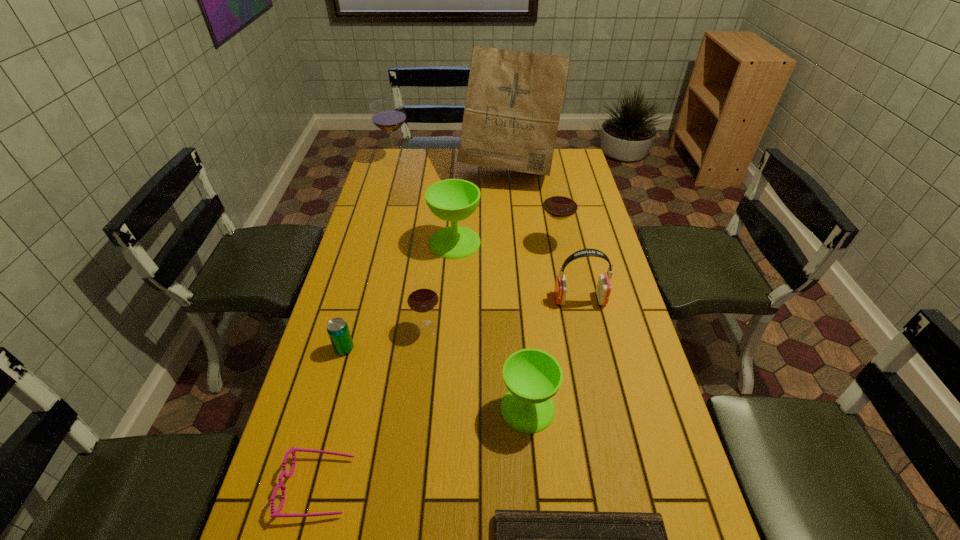
At what (x,y) coordinates should I click in order to perform the action: click on vacant space located 0.060m on the back of the farther green wineglass. Please return your answer as a coordinate pair (x, y). The image size is (960, 540). Looking at the image, I should click on (457, 217).

At what (x,y) coordinates should I click in order to perform the action: click on free space located on the left of the rightmost red wineglass. Please return your answer as a coordinate pair (x, y). This screenshot has width=960, height=540. Looking at the image, I should click on (434, 244).

Identify the location of vacant space located 0.130m on the outer surface of the fifth farthest object. The image size is (960, 540). (513, 299).

This screenshot has height=540, width=960. I want to click on free region located 0.070m on the outer surface of the fifth farthest object, so click(x=533, y=299).

Locate an element on the screen. The image size is (960, 540). blank space located on the outer surface of the fifth farthest object is located at coordinates (481, 299).

At what (x,y) coordinates should I click in order to perform the action: click on vacant space located on the back of the nearest red wineglass. Please return your answer as a coordinate pair (x, y). The image size is (960, 540). Looking at the image, I should click on (435, 252).

Where is `vacant region located on the front of the right green wineglass`? vacant region located on the front of the right green wineglass is located at coordinates (535, 486).

The width and height of the screenshot is (960, 540). I want to click on vacant area located 0.250m on the right of the teal beer can, so click(x=444, y=349).

Identify the location of free space located 0.180m on the arms of the spectacles. The width and height of the screenshot is (960, 540). (433, 487).

Locate an element on the screen. The width and height of the screenshot is (960, 540). grocery bag that is at the far edge is located at coordinates (514, 99).